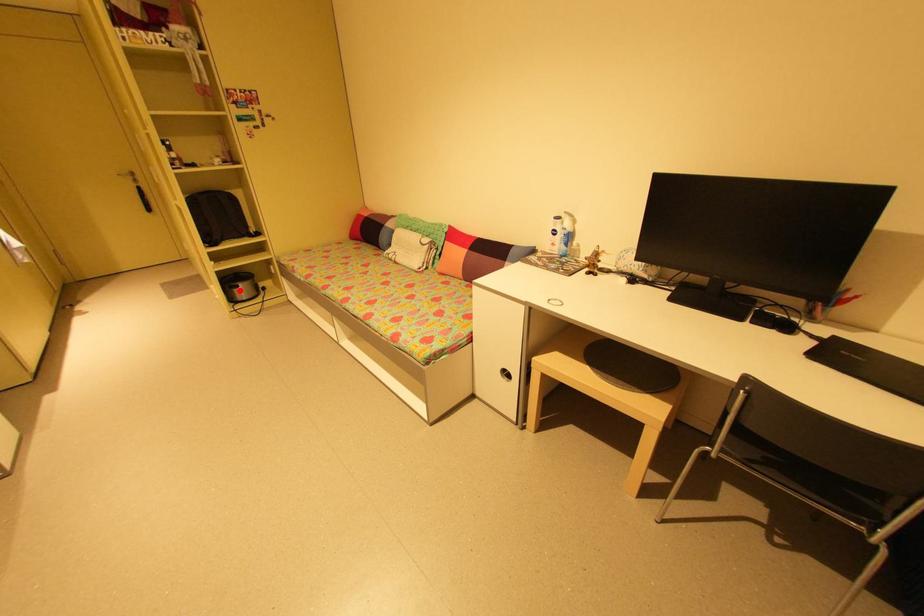
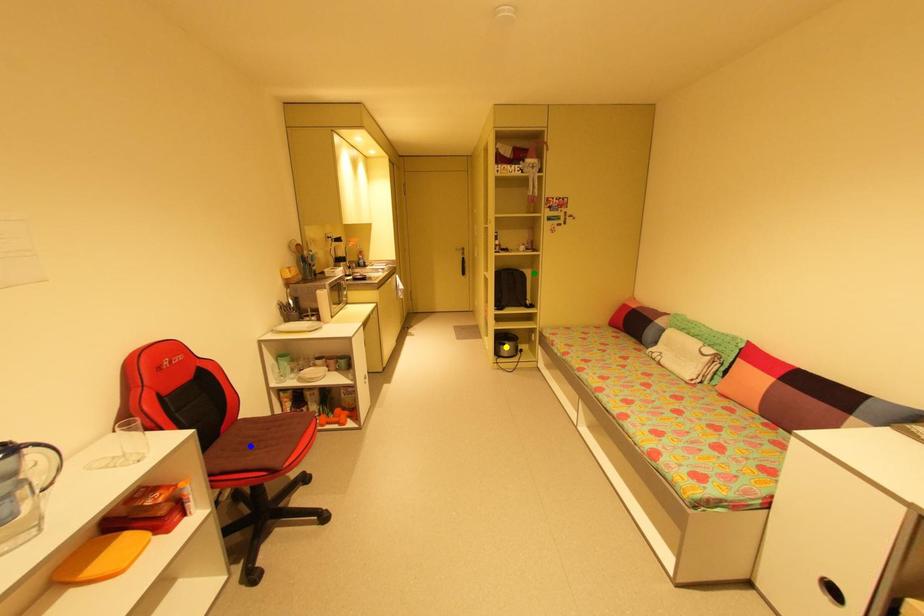
Question: I am providing you with two images of the same scene from different viewpoints. A red point is marked on the first image. You are given multiple points on the second image. Which mark in image 2 goes with the point in image 1?

Choices:
 (A) green point
 (B) blue point
 (C) yellow point

Answer: (C)